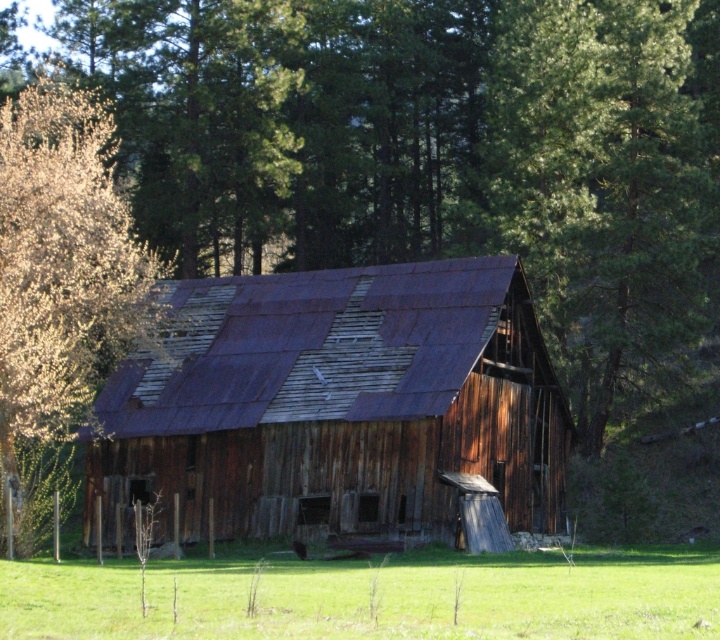
Question: Which of the following is the closest to the observer?

Choices:
 (A) green grass at lower center
 (B) golden textured leaves at left
 (C) rusty wood barn at center
 (D) green leafy tree at center

Answer: (A)

Question: Can you confirm if green leafy tree at center is thinner than golden textured leaves at left?

Choices:
 (A) yes
 (B) no

Answer: (B)

Question: Which of these objects is positioned closest to the green grass at lower center?

Choices:
 (A) green leafy tree at center
 (B) golden textured leaves at left

Answer: (B)

Question: Which of these objects is positioned farthest from the green grass at lower center?

Choices:
 (A) golden textured leaves at left
 (B) green leafy tree at center

Answer: (B)

Question: Does rusty wood barn at center have a lesser width compared to green leafy tree at center?

Choices:
 (A) yes
 (B) no

Answer: (B)

Question: Does rusty wood barn at center appear under green leafy tree at center?

Choices:
 (A) no
 (B) yes

Answer: (B)